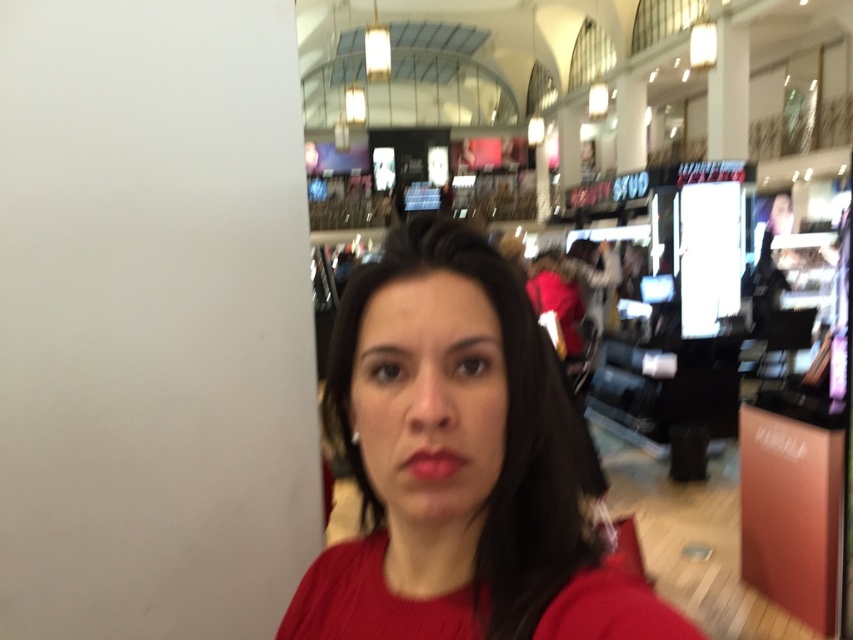
Question: In this image, where is matte red sweater at center located relative to matte red lipstick at center?

Choices:
 (A) left
 (B) right

Answer: (B)

Question: Can you confirm if matte red sweater at center is positioned to the right of matte red lipstick at center?

Choices:
 (A) yes
 (B) no

Answer: (A)

Question: Which point is closer to the camera?

Choices:
 (A) matte red lipstick at center
 (B) matte red sweater at center

Answer: (B)

Question: Which object is closer to the camera taking this photo?

Choices:
 (A) matte red lipstick at center
 (B) matte red sweater at center

Answer: (B)

Question: Does matte red sweater at center have a lesser width compared to matte red lipstick at center?

Choices:
 (A) yes
 (B) no

Answer: (B)

Question: Which of the following is the farthest from the observer?

Choices:
 (A) matte red sweater at center
 (B) matte red lipstick at center

Answer: (B)